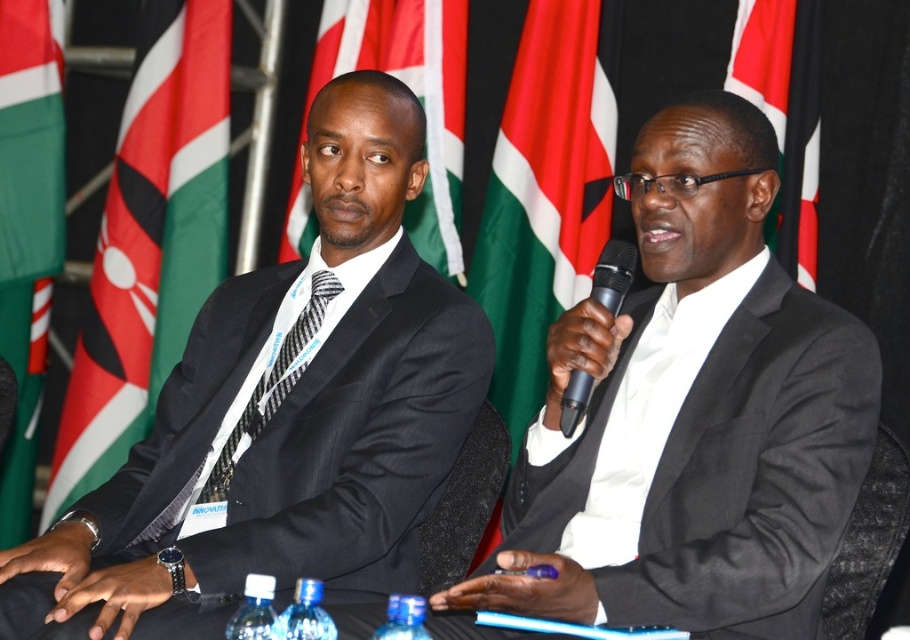
You are a photographer at a formal event. You need to capture a closeup of the matte black suit at left and the black carbon fiber tie at center. Which object is wider so that it can fit better in the frame?

The matte black suit at left is wider than the black carbon fiber tie at center, so it will fit better in the frame.

You are a photographer at a conference. You want to take a photo of the speaker holding the black plastic microphone at center without any obstructions. Is the green fabric flag at upper center blocking the microphone in the current setup?

The black plastic microphone at center is behind the green fabric flag at upper center, so the flag is blocking the microphone. To take an unobstructed photo, you would need to reposition either the microphone or the flag.